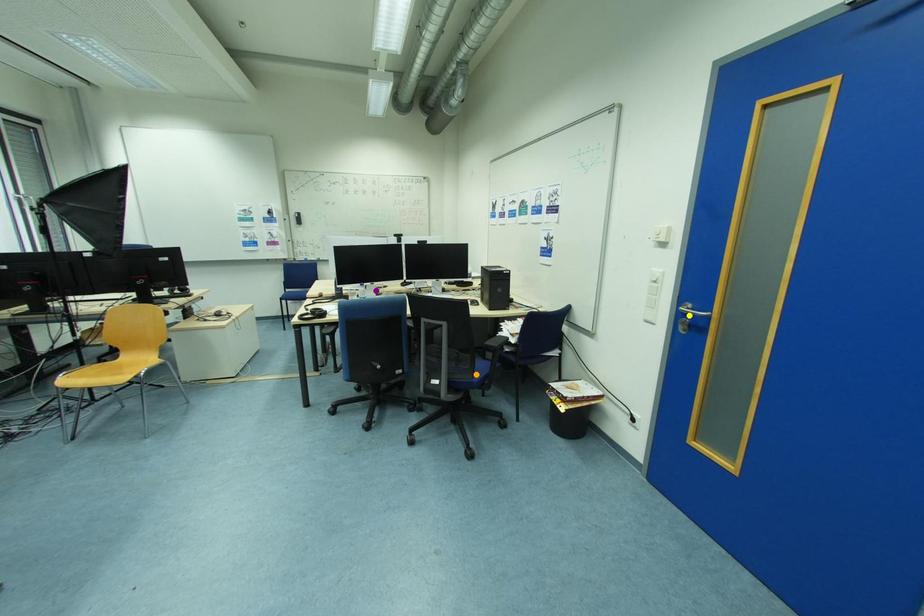
Order these from nearest to farthest:
purple point | orange point | yellow point

yellow point, orange point, purple point